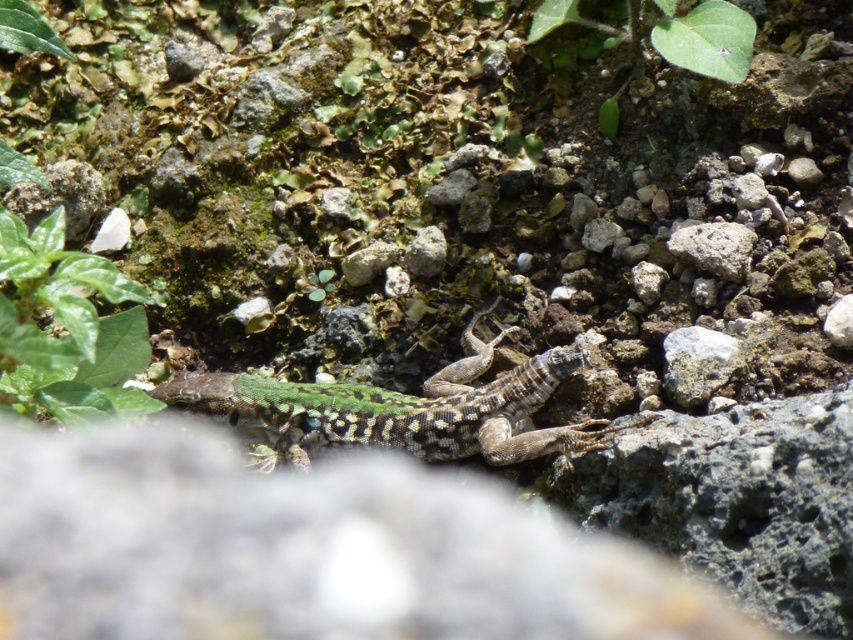
You are standing 5 feet away from a speckled green lizard at center. Can you reach it with a 1.5 feet long stick without moving closer?

The speckled green lizard at center is 4.22 feet away from the viewer. Since you are standing 5 feet away, the distance between you and the lizard is 0.78 feet. A 1.5 feet long stick would be sufficient to reach it.